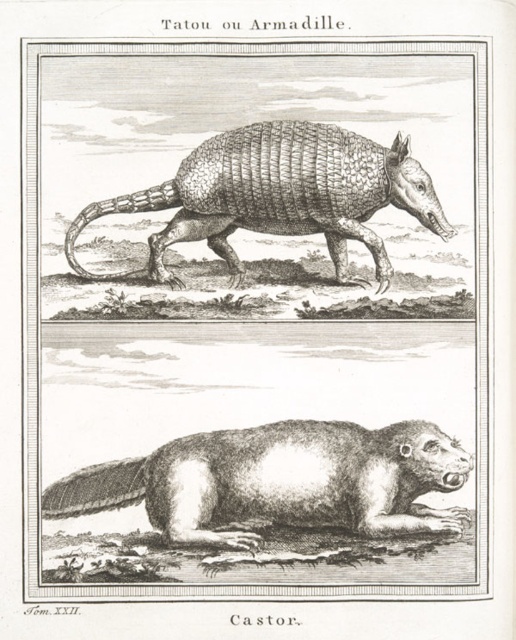
Is point (245, 432) closer to camera compared to point (218, 193)?

That is True.

Between white fur beaver at lower center and gray textured armadillo at upper center, which one is positioned lower?

white fur beaver at lower center

Measure the distance between white fur beaver at lower center and camera.

white fur beaver at lower center is 5.45 feet from camera.

Locate an element on the screen. white fur beaver at lower center is located at coordinates (280, 481).